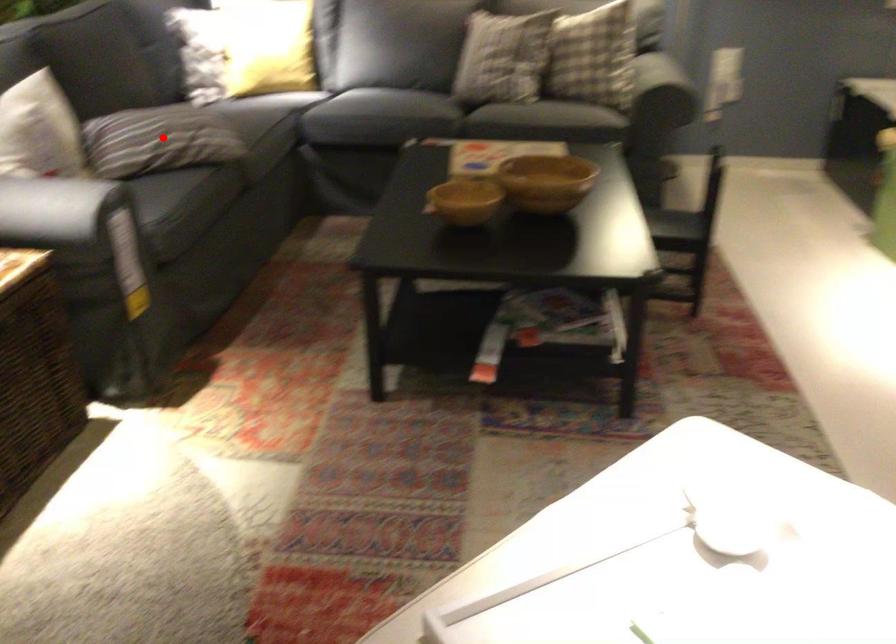
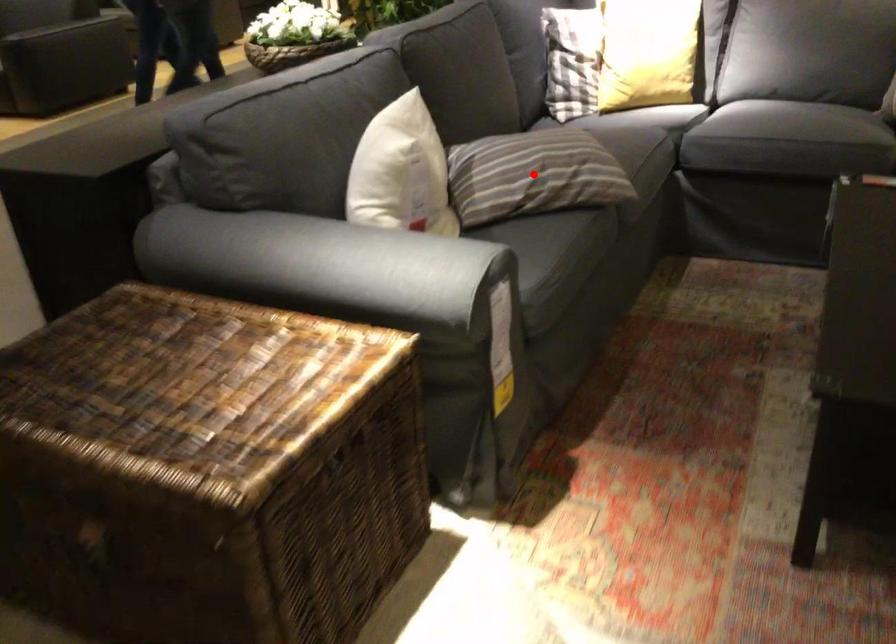
I am providing you with two images of the same scene from different viewpoints. A red point is marked on the first image and another point is marked on the second image. Is the red point in image1 aligned with the point shown in image2?

Yes